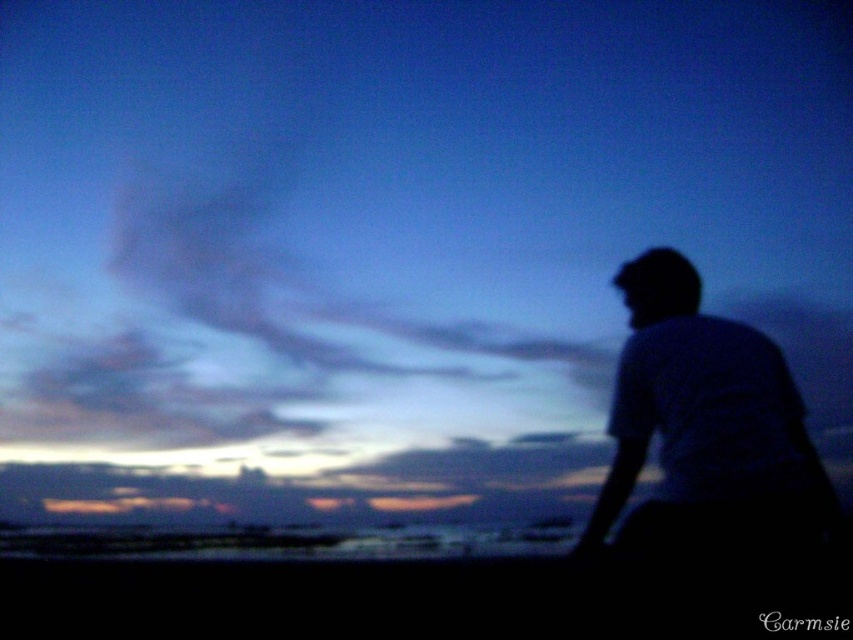
Question: Is dark fabric shirt at right smaller than black matte head at upper right?

Choices:
 (A) no
 (B) yes

Answer: (A)

Question: Which object appears farthest from the camera in this image?

Choices:
 (A) black matte head at upper right
 (B) dark fabric shirt at right

Answer: (A)

Question: Is dark fabric shirt at right smaller than black matte head at upper right?

Choices:
 (A) no
 (B) yes

Answer: (A)

Question: Which point is closer to the camera taking this photo?

Choices:
 (A) (764, 461)
 (B) (669, 317)

Answer: (A)

Question: Among these points, which one is farthest from the camera?

Choices:
 (A) (646, 400)
 (B) (625, 305)

Answer: (B)

Question: Can you confirm if dark fabric shirt at right is positioned above black matte head at upper right?

Choices:
 (A) yes
 (B) no

Answer: (B)